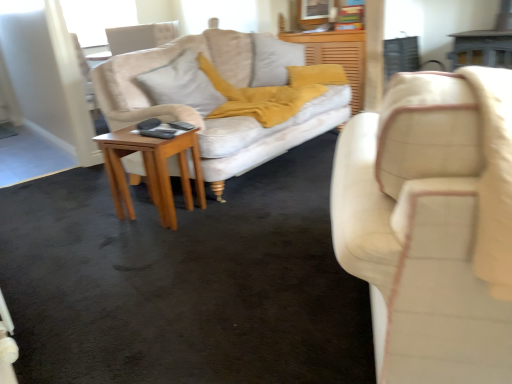
What do you see at coordinates (432, 224) in the screenshot? I see `matte cream studio couch at right` at bounding box center [432, 224].

Image resolution: width=512 pixels, height=384 pixels. Describe the element at coordinates (337, 56) in the screenshot. I see `wooden dresser at center` at that location.

Identify the location of matte cream studio couch at right. (432, 224).

Is light gray fabric pillow at center located within matte cream studio couch at right?

Actually, light gray fabric pillow at center is outside matte cream studio couch at right.

Can you confirm if matte cream studio couch at right is taller than light gray fabric pillow at center?

Yes, matte cream studio couch at right is taller than light gray fabric pillow at center.

Is matte cream studio couch at right placed right next to light gray fabric pillow at center?

No, matte cream studio couch at right is not with light gray fabric pillow at center.

Consider the image. Measure the distance between wooden dresser at center and light gray fabric pillow at center.

wooden dresser at center is 1.48 meters away from light gray fabric pillow at center.

Which object is further away from the camera taking this photo, wooden dresser at center or light gray fabric pillow at center?

wooden dresser at center is behind.

This screenshot has width=512, height=384. What are the coordinates of `pillow on the left of wooden dresser at center` in the screenshot? It's located at coord(182,84).

Is point (346, 36) in front of point (209, 91)?

No.

Can you tell me how much light brown wooden side table at center and light gray fabric pillow at center differ in facing direction?

They differ by 0.776 degrees in their facing directions.

From the image's perspective, does light brown wooden side table at center appear higher than light gray fabric pillow at center?

No, from the image's perspective, light brown wooden side table at center is not on top of light gray fabric pillow at center.

Is light brown wooden side table at center looking in the opposite direction of light gray fabric pillow at center?

light brown wooden side table at center is not turned away from light gray fabric pillow at center.

Looking at their sizes, would you say light brown wooden side table at center is wider or thinner than light gray fabric pillow at center?

light brown wooden side table at center is wider than light gray fabric pillow at center.

This screenshot has width=512, height=384. In order to click on table that is below the wooden dresser at center (from the image's perspective) in this screenshot , I will do `click(152, 170)`.

In the scene shown: How different are the orientations of light brown wooden side table at center and wooden dresser at center in degrees?

43.1 degrees.

Consider the image. Is light brown wooden side table at center inside the boundaries of wooden dresser at center, or outside?

light brown wooden side table at center exists outside the volume of wooden dresser at center.

Considering the sizes of objects light brown wooden side table at center and wooden dresser at center in the image provided, who is wider, light brown wooden side table at center or wooden dresser at center?

light brown wooden side table at center.

Identify the location of dresser behind the matte cream studio couch at right. (337, 56).

From the image's perspective, who appears lower, matte cream studio couch at right or wooden dresser at center?

matte cream studio couch at right, from the image's perspective.

Identify the location of table below the wooden dresser at center (from a real-world perspective). This screenshot has width=512, height=384. (152, 170).

Is wooden dresser at center at the right side of light brown wooden side table at center?

Yes, wooden dresser at center is to the right of light brown wooden side table at center.

Would you say wooden dresser at center is a long distance from light brown wooden side table at center?

Yes.

Based on their sizes in the image, would you say wooden dresser at center is bigger or smaller than light brown wooden side table at center?

Considering their sizes, wooden dresser at center takes up less space than light brown wooden side table at center.

Does point (345, 37) come behind point (420, 279)?

Yes, it is.

Between wooden dresser at center and matte cream studio couch at right, which one appears on the left side from the viewer's perspective?

wooden dresser at center is more to the left.

This screenshot has height=384, width=512. I want to click on studio couch in front of the wooden dresser at center, so click(x=432, y=224).

Based on the photo, is wooden dresser at center not within matte cream studio couch at right?

Yes, wooden dresser at center is located beyond the bounds of matte cream studio couch at right.

Locate an element on the screen. The image size is (512, 384). studio couch in front of the light gray fabric pillow at center is located at coordinates (432, 224).

Locate an element on the screen. The height and width of the screenshot is (384, 512). pillow above the wooden dresser at center (from a real-world perspective) is located at coordinates coord(182,84).

Which object lies further to the anchor point wooden dresser at center, light gray fabric pillow at center or matte cream studio couch at right?

The object further to wooden dresser at center is matte cream studio couch at right.

Looking at the image, which one is located closer to light brown wooden side table at center, wooden dresser at center or light gray fabric pillow at center?

light gray fabric pillow at center is closer to light brown wooden side table at center.

Based on their spatial positions, is wooden dresser at center or matte cream studio couch at right further from light brown wooden side table at center?

wooden dresser at center lies further to light brown wooden side table at center than the other object.

Which object lies nearer to the anchor point matte cream studio couch at right, light brown wooden side table at center or light gray fabric pillow at center?

Based on the image, light brown wooden side table at center appears to be nearer to matte cream studio couch at right.

Based on their spatial positions, is wooden dresser at center or light gray fabric pillow at center closer to matte cream studio couch at right?

Based on the image, light gray fabric pillow at center appears to be nearer to matte cream studio couch at right.

Looking at the image, which one is located closer to wooden dresser at center, matte cream studio couch at right or light gray fabric pillow at center?

light gray fabric pillow at center is positioned closer to the anchor wooden dresser at center.

Based on their spatial positions, is matte cream studio couch at right or light brown wooden side table at center further from wooden dresser at center?

matte cream studio couch at right.

From the image, which object appears to be farther from light brown wooden side table at center, light gray fabric pillow at center or matte cream studio couch at right?

The object further to light brown wooden side table at center is matte cream studio couch at right.

Locate an element on the screen. pillow located between matte cream studio couch at right and wooden dresser at center in the depth direction is located at coordinates (182, 84).

The image size is (512, 384). I want to click on pillow between light brown wooden side table at center and wooden dresser at center along the z-axis, so click(182, 84).

The image size is (512, 384). In order to click on table between matte cream studio couch at right and wooden dresser at center in the front-back direction in this screenshot , I will do `click(152, 170)`.

You are a GUI agent. You are given a task and a screenshot of the screen. Output one action in this format:
    pyautogui.click(x=<x>, y=<y>)
    Task: Click on the table between matte cream studio couch at right and light gray fabric pillow at center from front to back
    Image resolution: width=512 pixels, height=384 pixels.
    Given the screenshot: What is the action you would take?
    pyautogui.click(x=152, y=170)